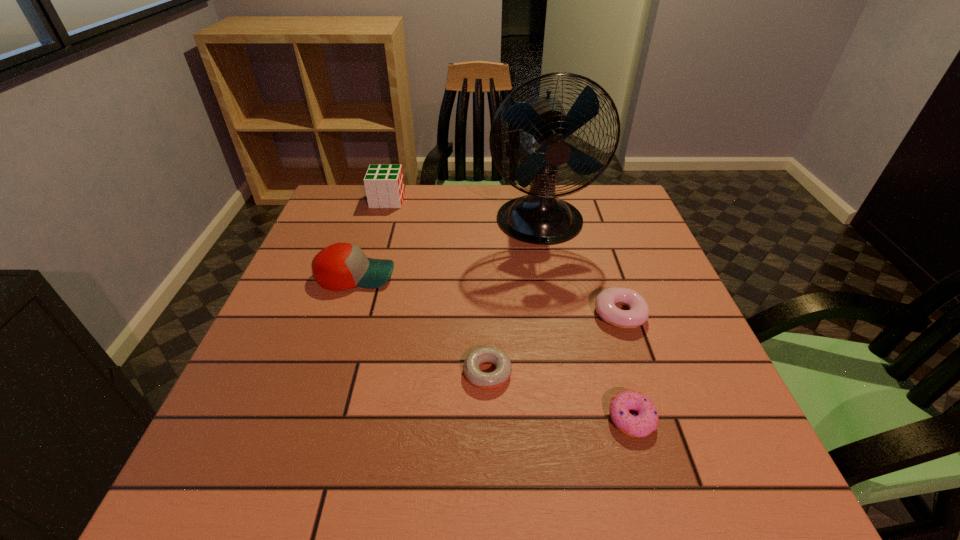
At what (x,y) coordinates should I click in order to perform the action: click on empty space between the tallest doughnut and the baseball cap. Please return your answer as a coordinate pair (x, y). The width and height of the screenshot is (960, 540). Looking at the image, I should click on (488, 295).

The height and width of the screenshot is (540, 960). In order to click on vacant point located between the nearest doughnut and the fifth farthest object in this screenshot , I will do `click(560, 396)`.

Where is `empty location between the fourth tallest object and the second tallest object`? The width and height of the screenshot is (960, 540). empty location between the fourth tallest object and the second tallest object is located at coordinates (503, 257).

Where is `unoccupied area between the cube and the farthest doughnut`? Image resolution: width=960 pixels, height=540 pixels. unoccupied area between the cube and the farthest doughnut is located at coordinates (503, 257).

I want to click on unoccupied position between the fan and the second nearest object, so point(514,298).

At what (x,y) coordinates should I click in order to perform the action: click on free space between the fifth farthest object and the fifth shortest object. Please return your answer as a coordinate pair (x, y). Looking at the image, I should click on (438, 287).

Where is `object that stands as the second closest to the tallest object`? object that stands as the second closest to the tallest object is located at coordinates (341, 266).

Choose which object is the fifth nearest neighbor to the third tallest object. Please provide its 2D coordinates. Your answer should be formatted as a tuple, i.e. [(x, y)], where the tuple contains the x and y coordinates of a point satisfying the conditions above.

[(646, 422)]

Identify which doughnut is the second closest to the fan. Please provide its 2D coordinates. Your answer should be formatted as a tuple, i.e. [(x, y)], where the tuple contains the x and y coordinates of a point satisfying the conditions above.

[(487, 381)]

Identify which doughnut is the nearest to the tallest doughnut. Please provide its 2D coordinates. Your answer should be formatted as a tuple, i.e. [(x, y)], where the tuple contains the x and y coordinates of a point satisfying the conditions above.

[(646, 422)]